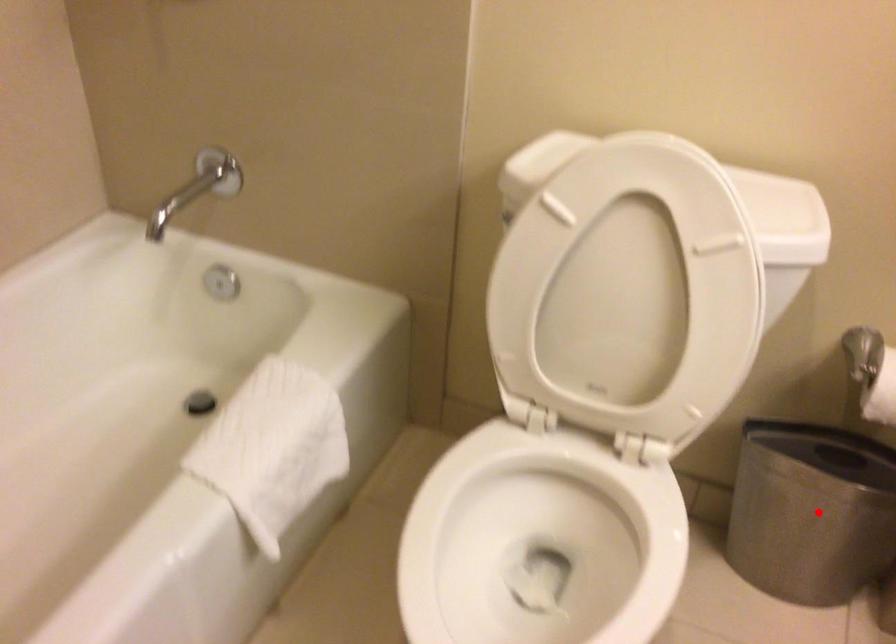
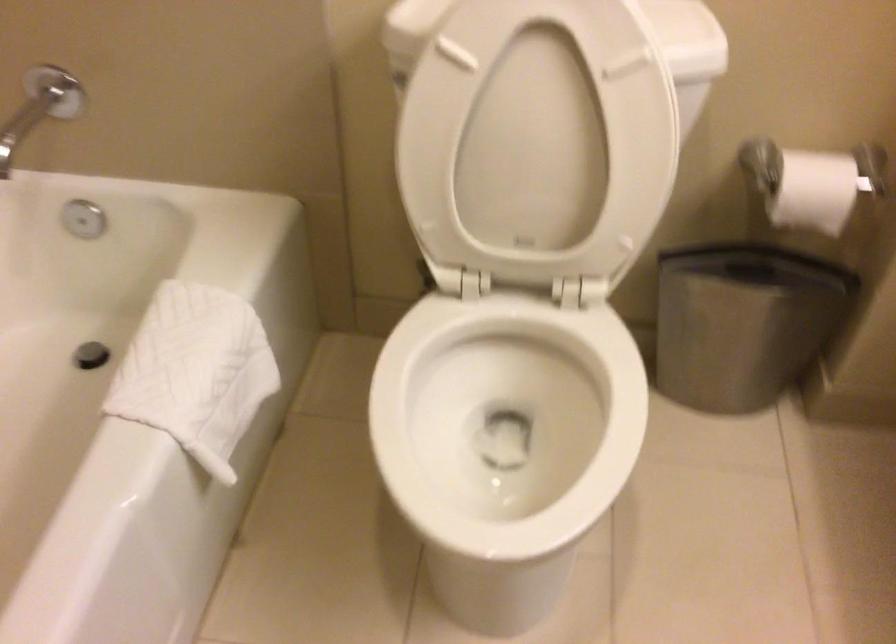
Locate, in the second image, the point that corresponds to the highlighted location in the first image.

(743, 323)